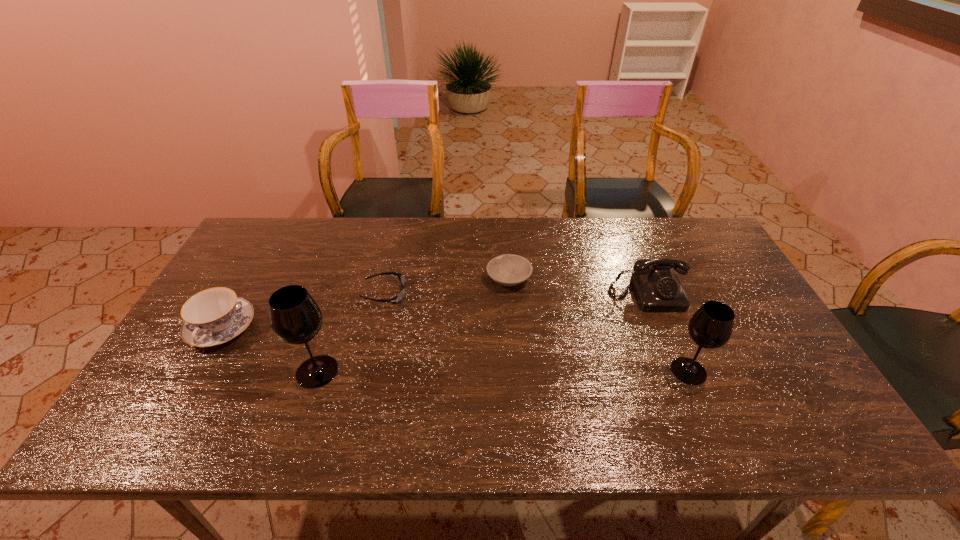
I want to click on free space that is in between the leftmost object and the right wineglass, so pyautogui.click(x=455, y=349).

Image resolution: width=960 pixels, height=540 pixels. I want to click on object that is the third closest to the taller wineglass, so click(508, 269).

This screenshot has height=540, width=960. I want to click on object identified as the fifth closest to the telephone, so click(x=214, y=316).

At what (x,y) coordinates should I click in order to perform the action: click on free point that satisfies the following two spatial constraints: 1. on the lenses of the sunglasses; 2. with the handle on the side of the fourth tallest object. Please return your answer as a coordinate pair (x, y). Looking at the image, I should click on (377, 328).

Find the location of a particular element. free spot that satisfies the following two spatial constraints: 1. with the handle on the side of the tallest object; 2. on the left side of the fourth tallest object is located at coordinates (197, 371).

Find the location of a particular element. Image resolution: width=960 pixels, height=540 pixels. free space that satisfies the following two spatial constraints: 1. with the handle on the side of the fourth tallest object; 2. on the right side of the second object from left to right is located at coordinates (197, 371).

Where is `free space that satisfies the following two spatial constraints: 1. on the lenses of the fourth object from right to left; 2. with the handle on the side of the chinaware`? This screenshot has height=540, width=960. free space that satisfies the following two spatial constraints: 1. on the lenses of the fourth object from right to left; 2. with the handle on the side of the chinaware is located at coordinates (377, 328).

Where is `blank area in the image that satisfies the following two spatial constraints: 1. on the back side of the fourth object from left to right; 2. on the left side of the taller wineglass`? The height and width of the screenshot is (540, 960). blank area in the image that satisfies the following two spatial constraints: 1. on the back side of the fourth object from left to right; 2. on the left side of the taller wineglass is located at coordinates (348, 278).

At what (x,y) coordinates should I click in order to perform the action: click on vacant position in the image that satisfies the following two spatial constraints: 1. on the front side of the second shortest object; 2. on the lenses of the shortest object. Please return your answer as a coordinate pair (x, y). The width and height of the screenshot is (960, 540). Looking at the image, I should click on (510, 294).

At what (x,y) coordinates should I click in order to perform the action: click on free location that satisfies the following two spatial constraints: 1. on the lenses of the fourth object from right to left; 2. on the back side of the fifth shortest object. Please return your answer as a coordinate pair (x, y). Image resolution: width=960 pixels, height=540 pixels. Looking at the image, I should click on (368, 371).